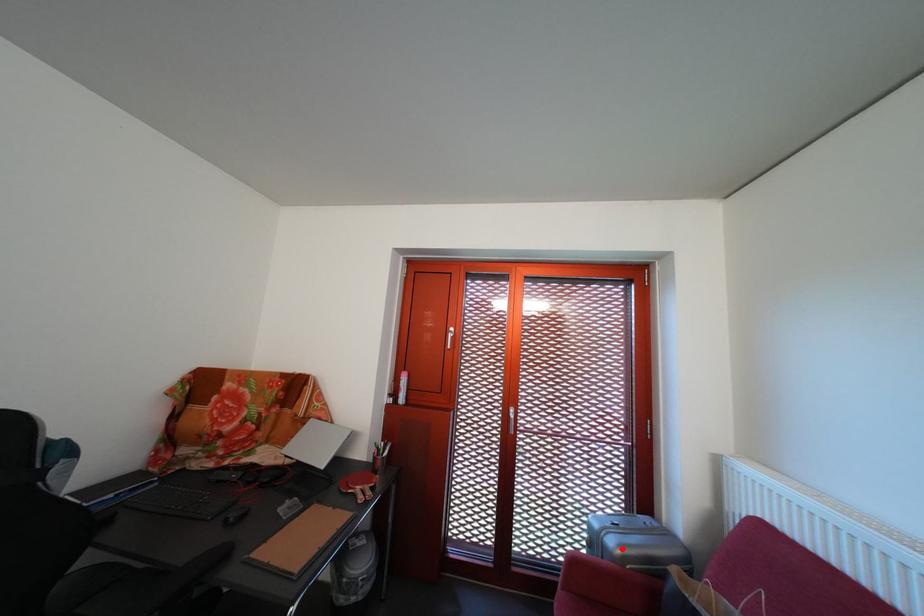
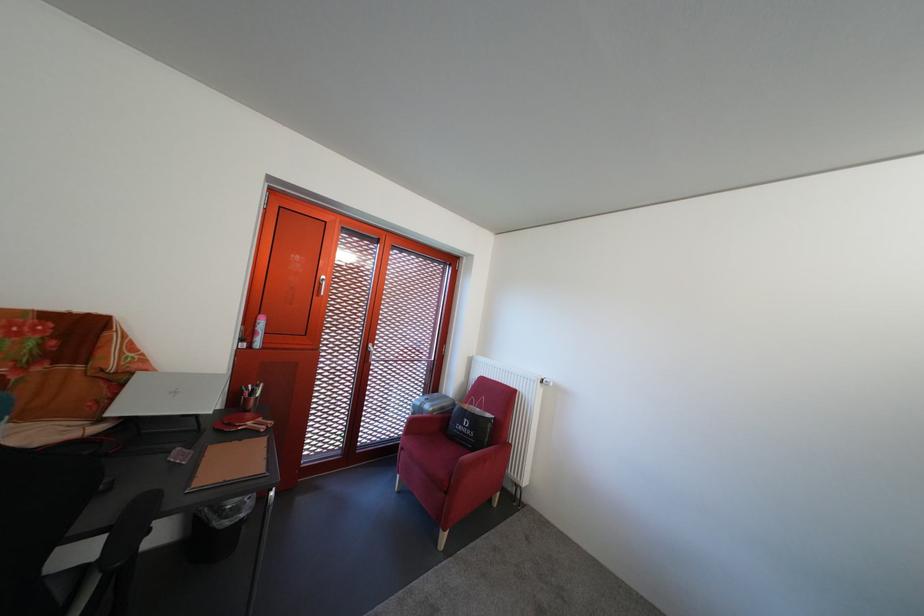
The point at the highlighted location is marked in the first image. Where is the corresponding point in the second image?

(439, 413)